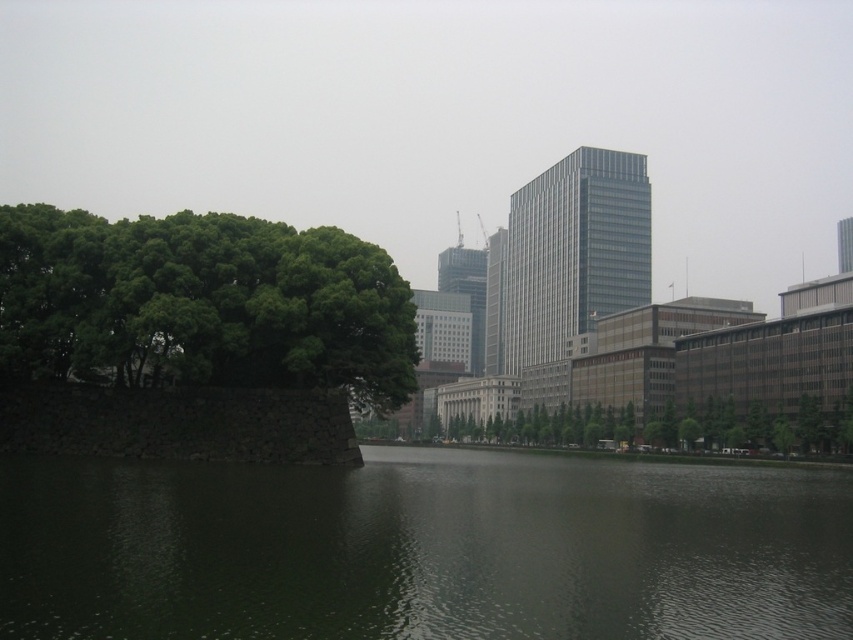
Question: Among these objects, which one is farthest from the camera?

Choices:
 (A) green leafy tree at left
 (B) green leafy tree at center
 (C) green water at center

Answer: (B)

Question: Estimate the real-world distances between objects in this image. Which object is farther from the green water at center?

Choices:
 (A) green leafy tree at left
 (B) green leafy tree at center

Answer: (B)

Question: Can you confirm if green water at center is smaller than green leafy tree at center?

Choices:
 (A) no
 (B) yes

Answer: (B)

Question: Is green water at center positioned behind green leafy tree at center?

Choices:
 (A) no
 (B) yes

Answer: (A)

Question: Based on their relative distances, which object is nearer to the green water at center?

Choices:
 (A) green leafy tree at left
 (B) green leafy tree at center

Answer: (A)

Question: Is the position of green water at center more distant than that of green leafy tree at center?

Choices:
 (A) yes
 (B) no

Answer: (B)